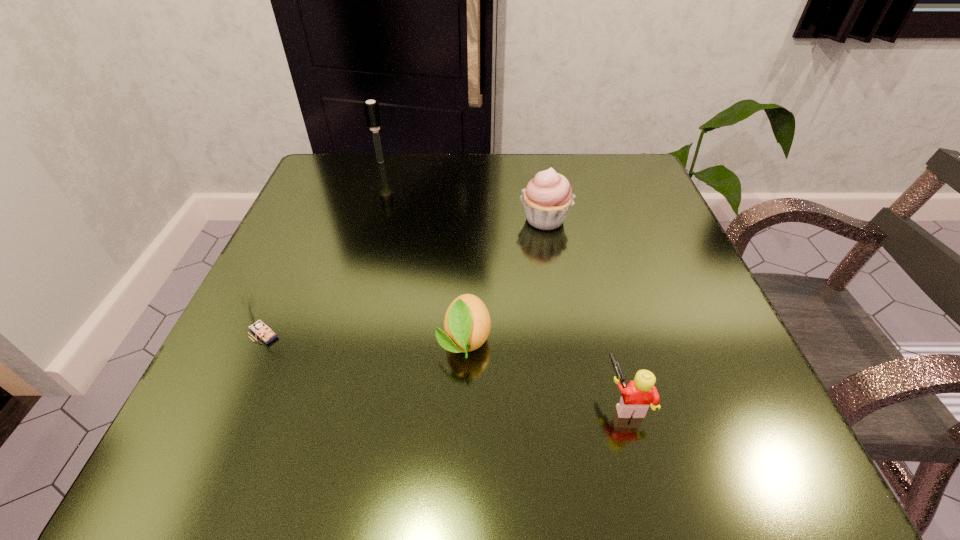
This screenshot has height=540, width=960. In order to click on object located at the far left corner in this screenshot , I will do `click(372, 111)`.

Where is `object that is at the near right corner`? The image size is (960, 540). object that is at the near right corner is located at coordinates (637, 396).

Find the location of a particular element. This screenshot has height=540, width=960. free space at the far edge of the desktop is located at coordinates (407, 194).

Identify the location of vacant space at the near edge of the desktop. This screenshot has width=960, height=540. (348, 422).

The width and height of the screenshot is (960, 540). I want to click on free location at the left edge of the desktop, so click(x=315, y=316).

Where is `vacant space at the right edge of the desktop`? The width and height of the screenshot is (960, 540). vacant space at the right edge of the desktop is located at coordinates (649, 250).

At what (x,y) coordinates should I click in order to perform the action: click on vacant space at the near left corner. Please return your answer as a coordinate pair (x, y). The width and height of the screenshot is (960, 540). Looking at the image, I should click on (254, 420).

This screenshot has width=960, height=540. I want to click on vacant space at the far right corner, so click(x=642, y=192).

The image size is (960, 540). Identify the location of vacant space that is in between the nearest object and the third object from left to right. (545, 370).

The image size is (960, 540). I want to click on empty location between the third object from left to right and the matchbox, so click(364, 336).